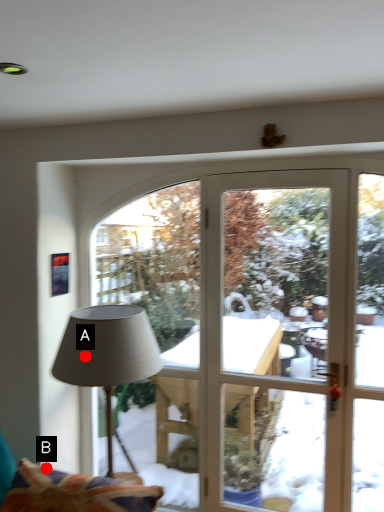
Question: Two points are circled on the image, labeled by A and B beside each circle. Which point appears farthest from the camera in this image?

Choices:
 (A) A is further
 (B) B is further

Answer: (B)